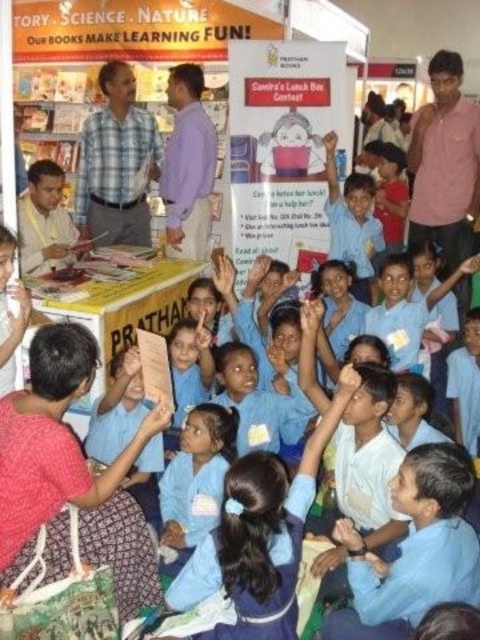
You are a photographer at the event and want to capture a photo that includes both the blue uniform shirt at center and the pink cotton shirt at upper right. Which shirt should you position on the left side of your photo to ensure both are visible?

The blue uniform shirt at center is already positioned on the left side of the pink cotton shirt at upper right, so to include both in the photo, you should position the blue uniform shirt at center on the left side of the pink cotton shirt at upper right.

You are a photographer at the event and need to capture a photo that includes both the pink cotton shirt at upper right and the purple shirt at center. Which shirt should you focus on first to ensure both are in frame?

The pink cotton shirt at upper right is bigger than the purple shirt at center, so you should focus on the pink cotton shirt at upper right first to ensure both are in frame.